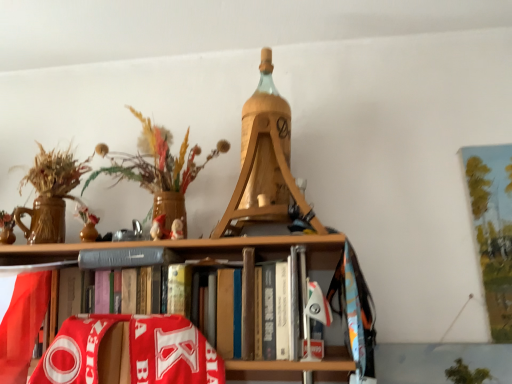
Question: Is gray matte book at center bigger than hardcover book at center?

Choices:
 (A) yes
 (B) no

Answer: (B)

Question: Is gray matte book at center facing away from hardcover book at center?

Choices:
 (A) yes
 (B) no

Answer: (A)

Question: Does gray matte book at center come in front of hardcover book at center?

Choices:
 (A) yes
 (B) no

Answer: (B)

Question: Considering the relative sizes of gray matte book at center and hardcover book at center in the image provided, is gray matte book at center thinner than hardcover book at center?

Choices:
 (A) no
 (B) yes

Answer: (B)

Question: From the image's perspective, is gray matte book at center below hardcover book at center?

Choices:
 (A) yes
 (B) no

Answer: (B)

Question: Is gray matte book at center smaller than hardcover book at center?

Choices:
 (A) yes
 (B) no

Answer: (A)

Question: From a real-world perspective, is wooden vase with dried flowers at upper left positioned over gray matte book at center based on gravity?

Choices:
 (A) yes
 (B) no

Answer: (A)

Question: From the image's perspective, does wooden vase with dried flowers at upper left appear higher than gray matte book at center?

Choices:
 (A) no
 (B) yes

Answer: (B)

Question: Is wooden vase with dried flowers at upper left closer to the viewer compared to gray matte book at center?

Choices:
 (A) yes
 (B) no

Answer: (A)

Question: Is wooden vase with dried flowers at upper left thinner than gray matte book at center?

Choices:
 (A) yes
 (B) no

Answer: (B)

Question: Can we say wooden vase with dried flowers at upper left lies outside gray matte book at center?

Choices:
 (A) yes
 (B) no

Answer: (A)

Question: Is gray matte book at center surrounded by wooden vase with dried flowers at upper left?

Choices:
 (A) no
 (B) yes

Answer: (A)

Question: Is gray matte book at center positioned with its back to wooden vase with dried flowers at upper left?

Choices:
 (A) no
 (B) yes

Answer: (A)